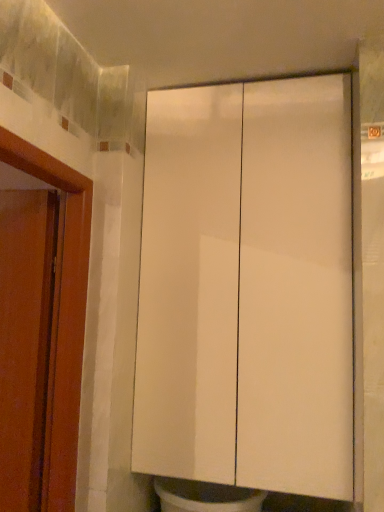
Question: Is white glossy cabinet at center oriented away from matte wood door at left?

Choices:
 (A) no
 (B) yes

Answer: (A)

Question: Does white glossy cabinet at center appear on the left side of matte wood door at left?

Choices:
 (A) yes
 (B) no

Answer: (B)

Question: Does white glossy cabinet at center turn towards matte wood door at left?

Choices:
 (A) no
 (B) yes

Answer: (A)

Question: Considering the relative positions of white glossy cabinet at center and matte wood door at left in the image provided, is white glossy cabinet at center to the right of matte wood door at left from the viewer's perspective?

Choices:
 (A) no
 (B) yes

Answer: (B)

Question: Is white glossy cabinet at center directly adjacent to matte wood door at left?

Choices:
 (A) yes
 (B) no

Answer: (B)

Question: From a real-world perspective, is white glossy cabinet at center on top of matte wood door at left?

Choices:
 (A) no
 (B) yes

Answer: (B)

Question: Can you confirm if matte wood door at left is taller than white glossy cabinet at center?

Choices:
 (A) no
 (B) yes

Answer: (A)

Question: Is matte wood door at left to the left of white glossy cabinet at center from the viewer's perspective?

Choices:
 (A) yes
 (B) no

Answer: (A)

Question: Is matte wood door at left oriented towards white glossy cabinet at center?

Choices:
 (A) no
 (B) yes

Answer: (A)

Question: Are matte wood door at left and white glossy cabinet at center making contact?

Choices:
 (A) no
 (B) yes

Answer: (A)

Question: From a real-world perspective, is matte wood door at left physically below white glossy cabinet at center?

Choices:
 (A) no
 (B) yes

Answer: (B)

Question: Is matte wood door at left not within white glossy cabinet at center?

Choices:
 (A) yes
 (B) no

Answer: (A)

Question: From the image's perspective, relative to matte wood door at left, is white glossy cabinet at center above or below?

Choices:
 (A) below
 (B) above

Answer: (B)